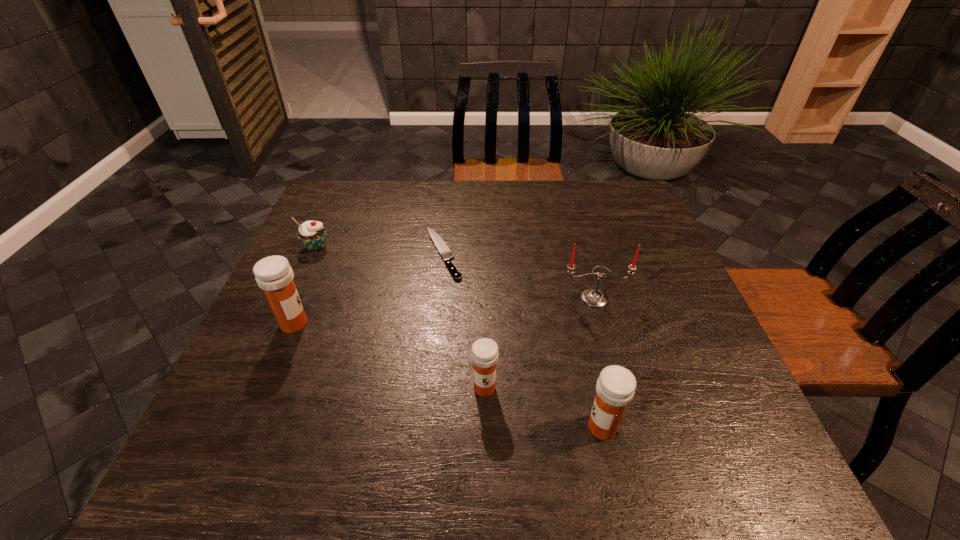
Please point a spot to place another medicine for symmetrical spacing. Please provide its 2D coordinates. Your answer should be formatted as a tuple, i.e. [(x, y)], where the tuple contains the x and y coordinates of a point satisfying the conditions above.

[(383, 354)]